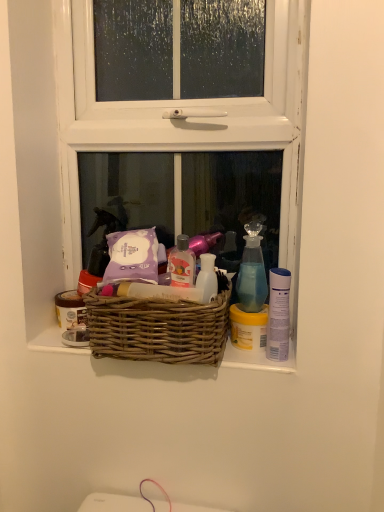
Question: Considering the relative positions of white wooden window at center and matte brown jar at left, the first toiletry when ordered from left to right, in the image provided, is white wooden window at center to the left of matte brown jar at left, the first toiletry when ordered from left to right, from the viewer's perspective?

Choices:
 (A) yes
 (B) no

Answer: (B)

Question: Considering the relative sizes of white wooden window at center and matte brown jar at left, acting as the 2th toiletry starting from the front, in the image provided, is white wooden window at center bigger than matte brown jar at left, acting as the 2th toiletry starting from the front,?

Choices:
 (A) no
 (B) yes

Answer: (B)

Question: Is matte brown jar at left, acting as the 1th toiletry starting from the back, located within white wooden window at center?

Choices:
 (A) yes
 (B) no

Answer: (A)

Question: Is white wooden window at center taller than matte brown jar at left, acting as the 1th toiletry starting from the back?

Choices:
 (A) no
 (B) yes

Answer: (B)

Question: From the image's perspective, is white wooden window at center located above matte brown jar at left, acting as the 1th toiletry starting from the back?

Choices:
 (A) yes
 (B) no

Answer: (A)

Question: In the image, is blue glass spray bottle at upper right on the left side or the right side of woven brown basket at center?

Choices:
 (A) left
 (B) right

Answer: (B)

Question: Is blue glass spray bottle at upper right bigger or smaller than woven brown basket at center?

Choices:
 (A) big
 (B) small

Answer: (B)

Question: Which is correct: blue glass spray bottle at upper right is inside woven brown basket at center, or outside of it?

Choices:
 (A) outside
 (B) inside

Answer: (A)

Question: From a real-world perspective, is blue glass spray bottle at upper right above or below woven brown basket at center?

Choices:
 (A) below
 (B) above

Answer: (B)

Question: Based on their sizes in the image, would you say white wooden window at center is bigger or smaller than matte brown jar at left, acting as the 1th toiletry starting from the back?

Choices:
 (A) big
 (B) small

Answer: (A)

Question: Is white wooden window at center taller or shorter than matte brown jar at left, the second toiletry from the right?

Choices:
 (A) tall
 (B) short

Answer: (A)

Question: From a real-world perspective, relative to matte brown jar at left, the second toiletry from the right, is white wooden window at center vertically above or below?

Choices:
 (A) below
 (B) above

Answer: (B)

Question: Is white wooden window at center spatially inside matte brown jar at left, acting as the 2th toiletry starting from the front, or outside of it?

Choices:
 (A) inside
 (B) outside

Answer: (B)

Question: From a real-world perspective, is blue glass spray bottle at upper right above or below white wooden window at center?

Choices:
 (A) above
 (B) below

Answer: (B)

Question: In terms of height, does blue glass spray bottle at upper right look taller or shorter compared to white wooden window at center?

Choices:
 (A) tall
 (B) short

Answer: (B)